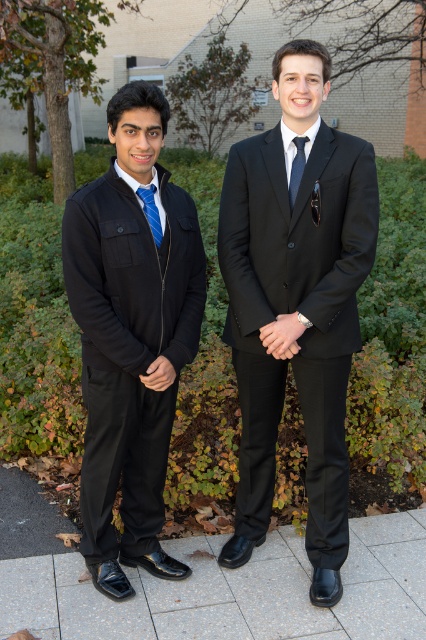
Find the location of `matte black suit at center`. matte black suit at center is located at coordinates (296, 301).

Does matte black suit at center appear over blue striped tie at left?

No.

Which is in front, point (95, 269) or point (158, 232)?

Point (95, 269) is in front.

The width and height of the screenshot is (426, 640). Identify the location of matte black suit at center. (296, 301).

Can you confirm if gray concrete pavement at lower center is bigger than dark blue silk tie at center?

Yes.

Where is `gray concrete pavement at lower center`? This screenshot has width=426, height=640. gray concrete pavement at lower center is located at coordinates (233, 592).

Who is taller, black satin suit at center or blue striped tie at left?

With more height is black satin suit at center.

Between point (311, 291) and point (158, 230), which one is positioned in front?

Point (158, 230) is more forward.

Locate an element on the screen. This screenshot has height=640, width=426. black satin suit at center is located at coordinates (296, 310).